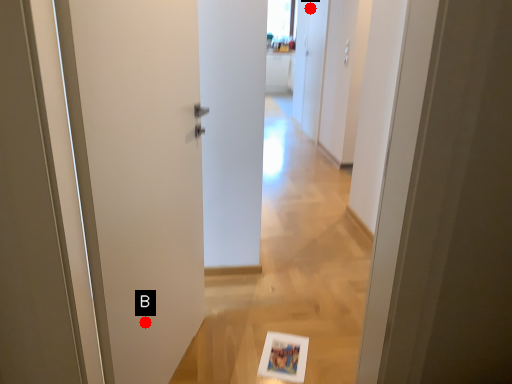
Question: Two points are circled on the image, labeled by A and B beside each circle. Which point appears farthest from the camera in this image?

Choices:
 (A) A is further
 (B) B is further

Answer: (A)